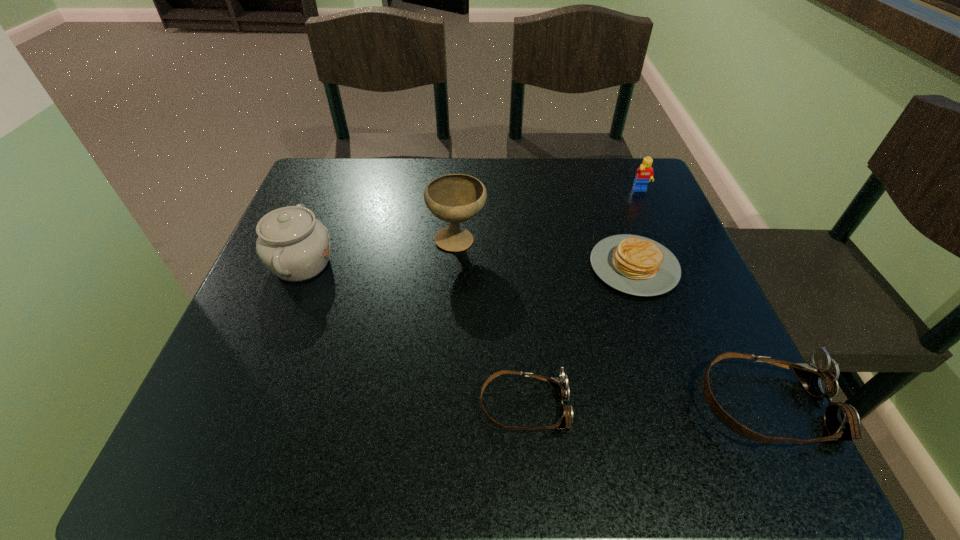
Identify the location of free location located on the right of the chalice. (550, 241).

Find the location of a particular element. vacant space located 0.170m on the back of the pancake is located at coordinates (609, 193).

The image size is (960, 540). Identify the location of free space located on the back of the chinaware. coord(339,171).

The image size is (960, 540). What are the coordinates of `object located at the far edge` in the screenshot? It's located at (645, 172).

Image resolution: width=960 pixels, height=540 pixels. What are the coordinates of `object located in the left edge section of the desktop` in the screenshot? It's located at (291, 243).

This screenshot has height=540, width=960. I want to click on goggles present at the right edge, so click(x=819, y=377).

What are the coordinates of `Lego positioned at the right edge` in the screenshot? It's located at (645, 172).

Locate an element on the screen. Image resolution: width=960 pixels, height=540 pixels. pancake at the right edge is located at coordinates (636, 265).

The image size is (960, 540). Find the location of `object that is positioned at the far right corner`. object that is positioned at the far right corner is located at coordinates (645, 172).

Where is `object that is at the near right corner`? Image resolution: width=960 pixels, height=540 pixels. object that is at the near right corner is located at coordinates (819, 377).